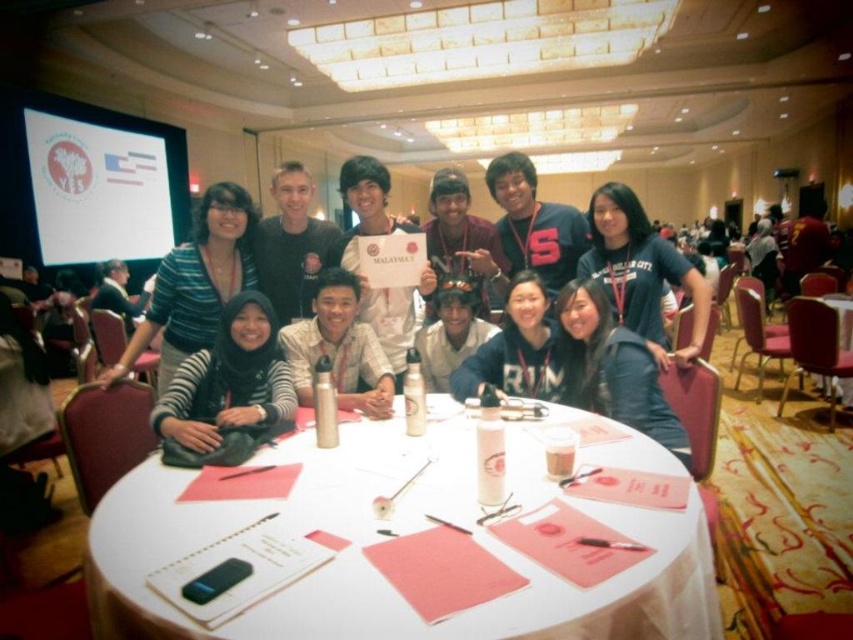
You are standing at the entrance of the room and see the point marked at coordinates (403, 532). Where is this point located in relation to the white paper at center?

The point marked at coordinates (403, 532) is located on the white paper at center.